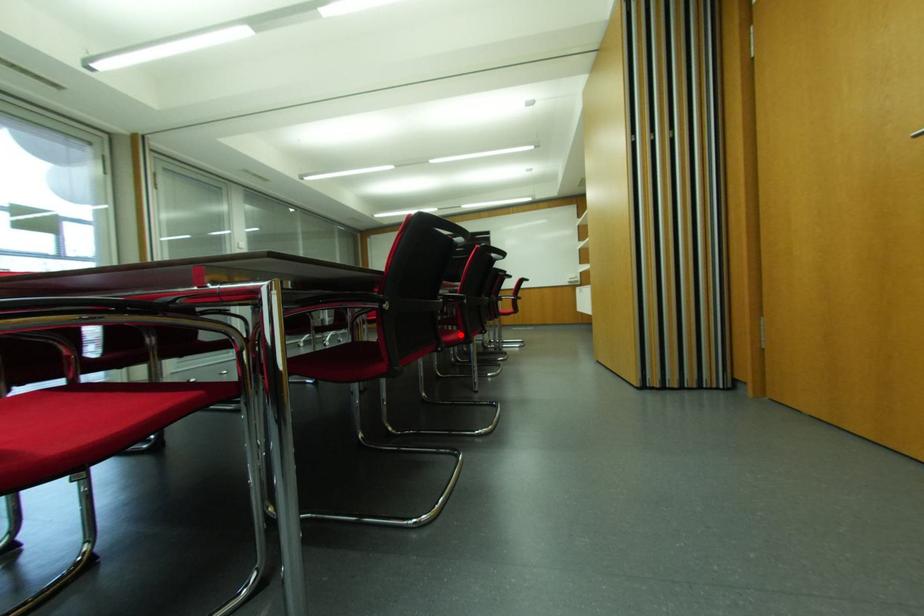
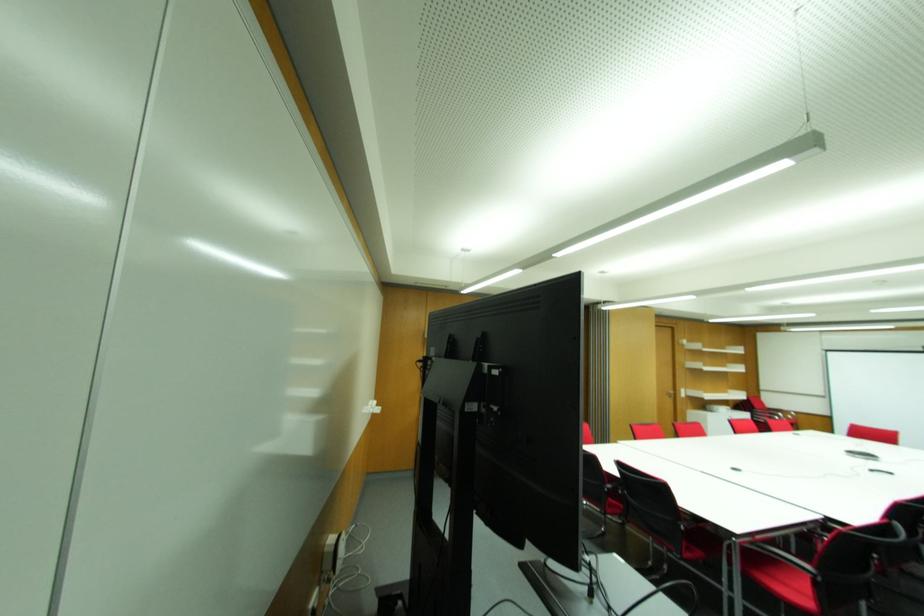
Question: I am providing you with two images of the same scene from different viewpoints. A red point is marked on the first image. Is the red point's position out of view in image 2?

Choices:
 (A) Yes
 (B) No

Answer: (A)